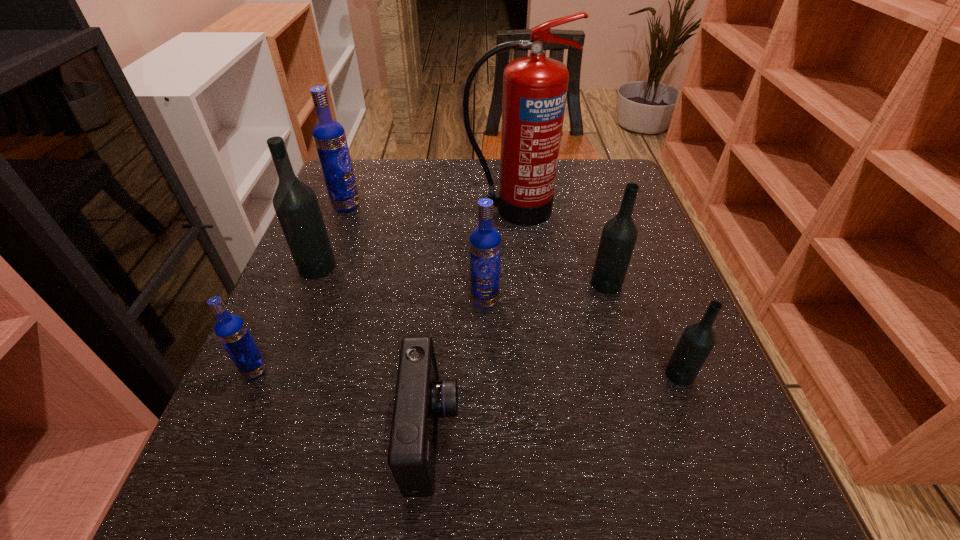
At what (x,y) coordinates should I click in order to perform the action: click on fire extinguisher. Please return your answer as a coordinate pair (x, y). This screenshot has height=540, width=960. Looking at the image, I should click on (535, 87).

Locate an element on the screen. The image size is (960, 540). red fire extinguisher is located at coordinates (535, 87).

Image resolution: width=960 pixels, height=540 pixels. In order to click on the farthest blue vodka in this screenshot , I will do `click(329, 137)`.

I want to click on the farthest vodka, so click(329, 137).

Locate an element on the screen. This screenshot has width=960, height=540. the leftmost black vodka is located at coordinates (296, 205).

Locate an element on the screen. Image resolution: width=960 pixels, height=540 pixels. the second smallest blue vodka is located at coordinates (485, 241).

The image size is (960, 540). Identify the location of the rightmost blue vodka. (485, 241).

What are the coordinates of `the second vodka from right to left` in the screenshot? It's located at (x=619, y=235).

At what (x,y) coordinates should I click in order to perform the action: click on the second object from right to left. Please return your answer as a coordinate pair (x, y). Looking at the image, I should click on (619, 235).

Where is `the nearest blue vodka`? the nearest blue vodka is located at coordinates (231, 330).